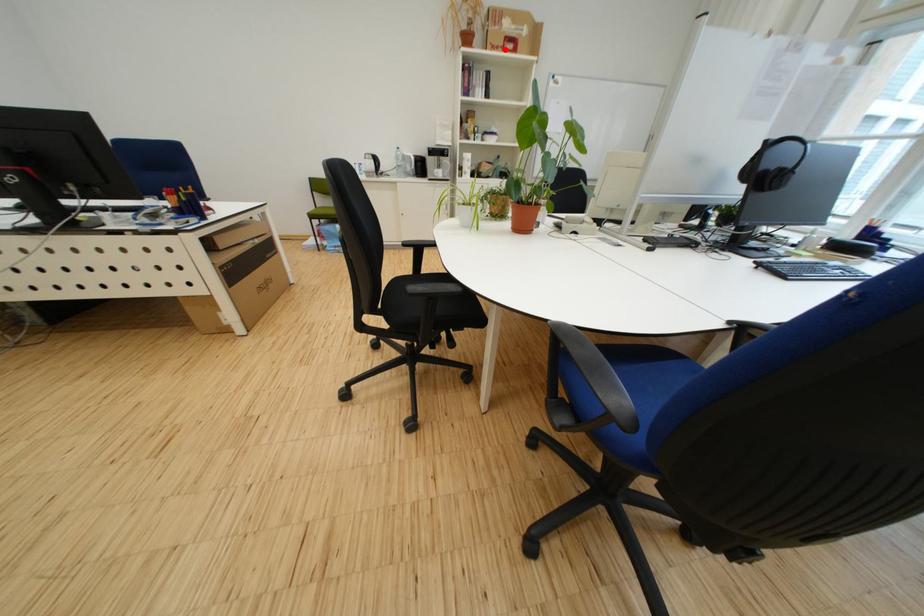
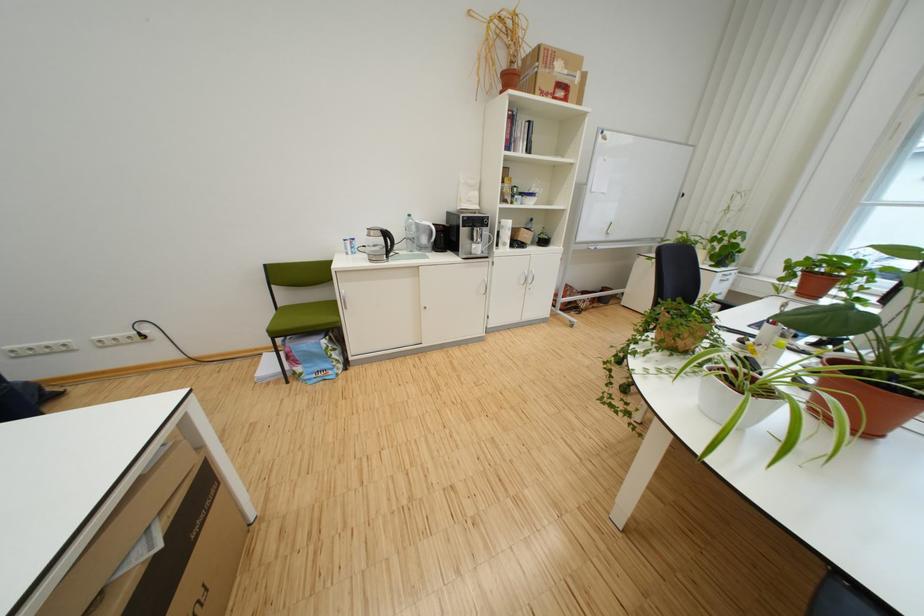
Find the pixel in the second image that matches the highlighted location in the first image.

(553, 95)